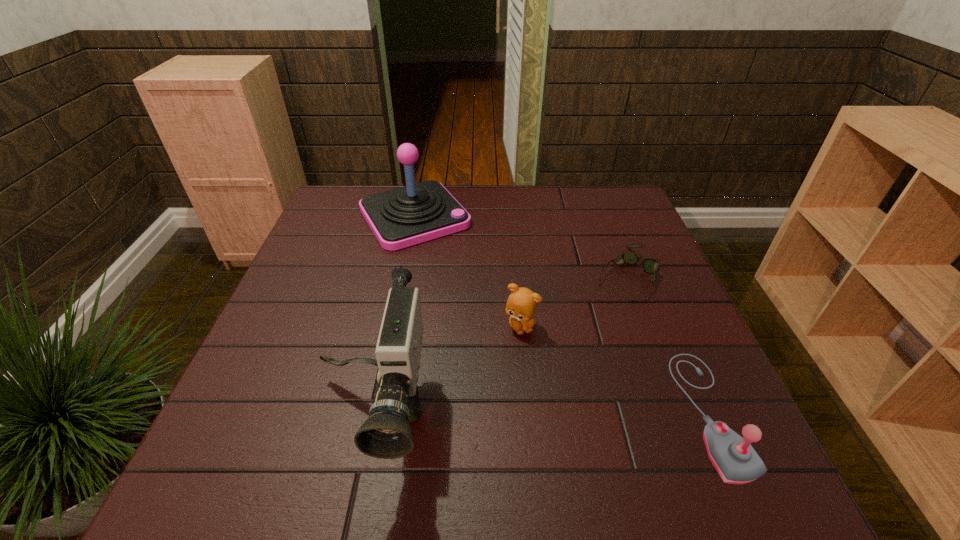
Where is `free space on the desktop that is between the camcorder and the nearer joystick and is positioned forward from the base of the taller joystick`? This screenshot has width=960, height=540. free space on the desktop that is between the camcorder and the nearer joystick and is positioned forward from the base of the taller joystick is located at coordinates (564, 413).

Image resolution: width=960 pixels, height=540 pixels. I want to click on vacant space on the desktop that is between the camcorder and the shorter joystick and is positioned on the face of the third object from left to right, so click(566, 413).

The width and height of the screenshot is (960, 540). What are the coordinates of `free space on the desktop that is between the camcorder and the shorter joystick and is positioned on the front-facing side of the shortest object` in the screenshot? It's located at (494, 413).